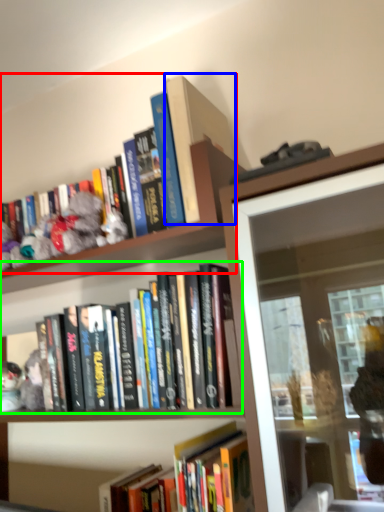
Question: Which object is positioned closest to book (highlighted by a red box)? Select from book (highlighted by a blue box) and book (highlighted by a green box).

Choices:
 (A) book
 (B) book

Answer: (A)